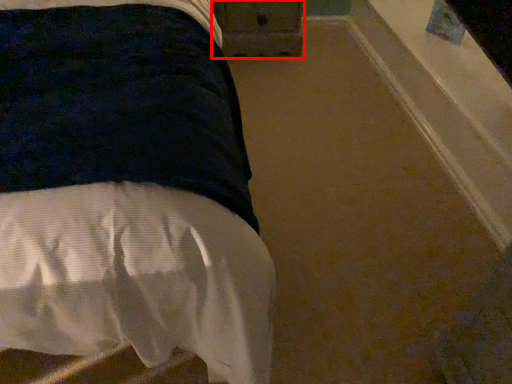
Question: Considering the relative positions of drawer (annotated by the red box) and bed in the image provided, where is drawer (annotated by the red box) located with respect to the staircase?

Choices:
 (A) left
 (B) right

Answer: (B)